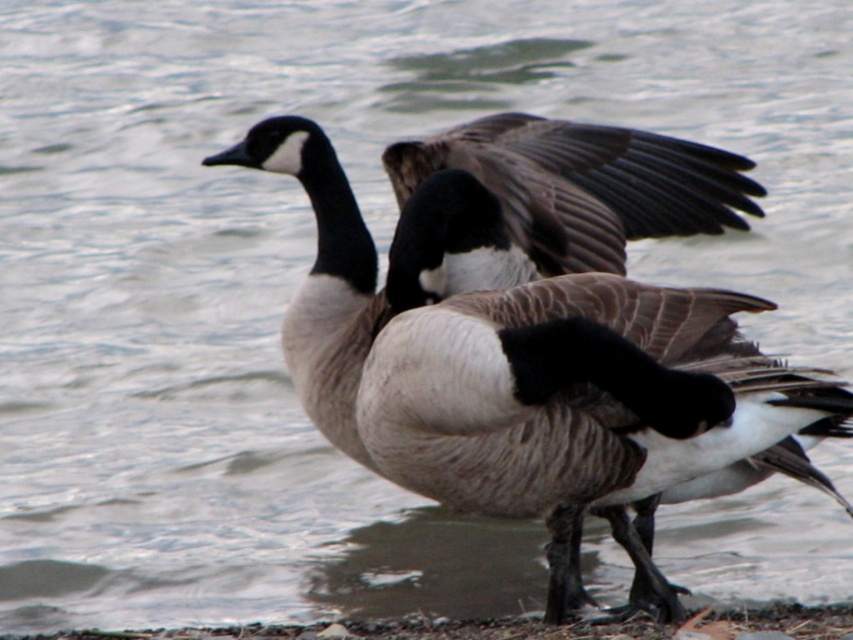
Question: Among these points, which one is farthest from the camera?

Choices:
 (A) (634, 406)
 (B) (660, 204)

Answer: (B)

Question: Is the position of brown feathered duck at center more distant than that of dark gray feathered wing at center?

Choices:
 (A) yes
 (B) no

Answer: (B)

Question: Is brown feathered duck at center further to the viewer compared to dark gray feathered wing at center?

Choices:
 (A) yes
 (B) no

Answer: (B)

Question: Does brown feathered duck at center come behind dark gray feathered wing at center?

Choices:
 (A) yes
 (B) no

Answer: (B)